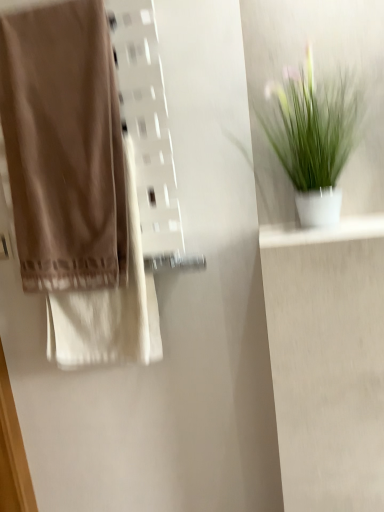
Question: From a real-world perspective, is green matte plant at upper right positioned under white glossy shelf at upper right based on gravity?

Choices:
 (A) no
 (B) yes

Answer: (A)

Question: Is green matte plant at upper right completely or partially outside of white glossy shelf at upper right?

Choices:
 (A) no
 (B) yes

Answer: (B)

Question: Is green matte plant at upper right behind white glossy shelf at upper right?

Choices:
 (A) yes
 (B) no

Answer: (B)

Question: Does green matte plant at upper right have a larger size compared to white glossy shelf at upper right?

Choices:
 (A) yes
 (B) no

Answer: (A)

Question: Is green matte plant at upper right smaller than white glossy shelf at upper right?

Choices:
 (A) no
 (B) yes

Answer: (A)

Question: Is white glossy shelf at upper right bigger or smaller than green matte plant at upper right?

Choices:
 (A) big
 (B) small

Answer: (B)

Question: From a real-world perspective, is white glossy shelf at upper right physically located above or below green matte plant at upper right?

Choices:
 (A) below
 (B) above

Answer: (A)

Question: Is white glossy shelf at upper right in front of or behind green matte plant at upper right in the image?

Choices:
 (A) front
 (B) behind

Answer: (B)

Question: From the image's perspective, is white glossy shelf at upper right located above or below green matte plant at upper right?

Choices:
 (A) below
 (B) above

Answer: (A)

Question: Is matte brown towel at left wider or thinner than green matte plant at upper right?

Choices:
 (A) wide
 (B) thin

Answer: (B)

Question: In terms of height, does matte brown towel at left look taller or shorter compared to green matte plant at upper right?

Choices:
 (A) short
 (B) tall

Answer: (B)

Question: From a real-world perspective, is matte brown towel at left physically located above or below green matte plant at upper right?

Choices:
 (A) above
 (B) below

Answer: (A)

Question: From the image's perspective, is matte brown towel at left located above or below green matte plant at upper right?

Choices:
 (A) below
 (B) above

Answer: (A)

Question: Considering their positions, is green matte plant at upper right located in front of or behind white glossy shelf at upper right?

Choices:
 (A) behind
 (B) front

Answer: (B)

Question: Is green matte plant at upper right situated inside white glossy shelf at upper right or outside?

Choices:
 (A) outside
 (B) inside

Answer: (A)